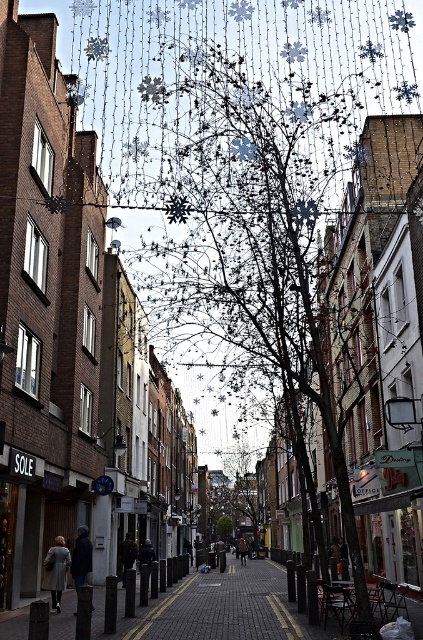
Question: Which of the following is the closest to the observer?

Choices:
 (A) (266, 600)
 (B) (225, 538)

Answer: (A)

Question: In this image, where is brick pavement at center located relative to green leafy tree at center?

Choices:
 (A) right
 (B) left

Answer: (A)

Question: From the image, what is the correct spatial relationship of brick pavement at center in relation to green leafy tree at center?

Choices:
 (A) right
 (B) left

Answer: (A)

Question: Which point is farther to the camera?

Choices:
 (A) green leafy tree at center
 (B) brick pavement at center

Answer: (A)

Question: Does brick pavement at center appear over green leafy tree at center?

Choices:
 (A) yes
 (B) no

Answer: (A)